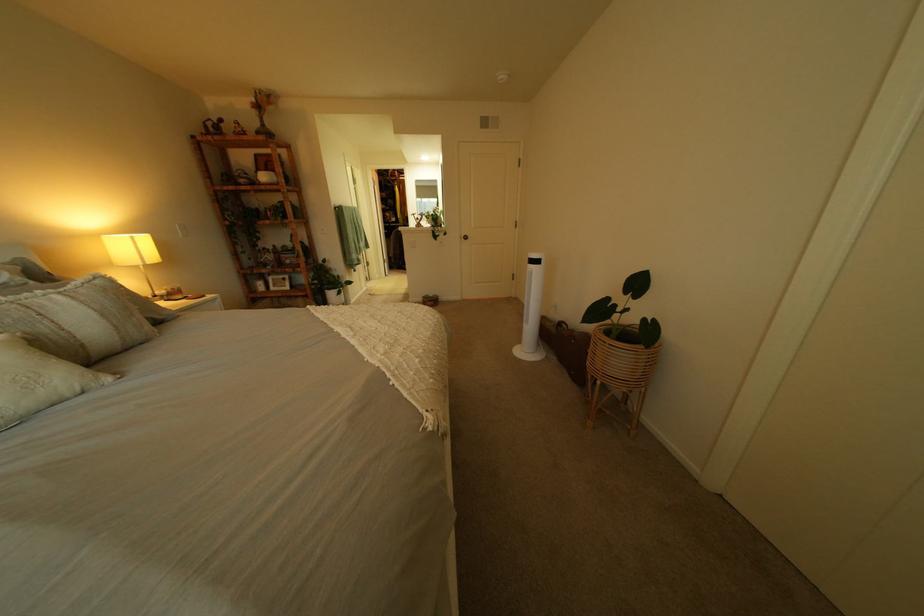
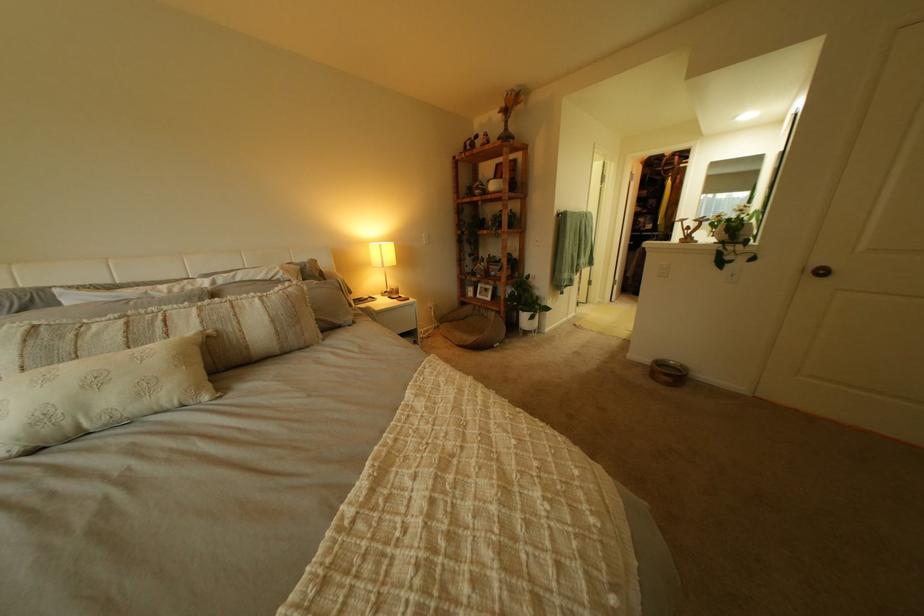
Where in the second image is the point corresponding to point (262, 175) from the first image?

(497, 185)